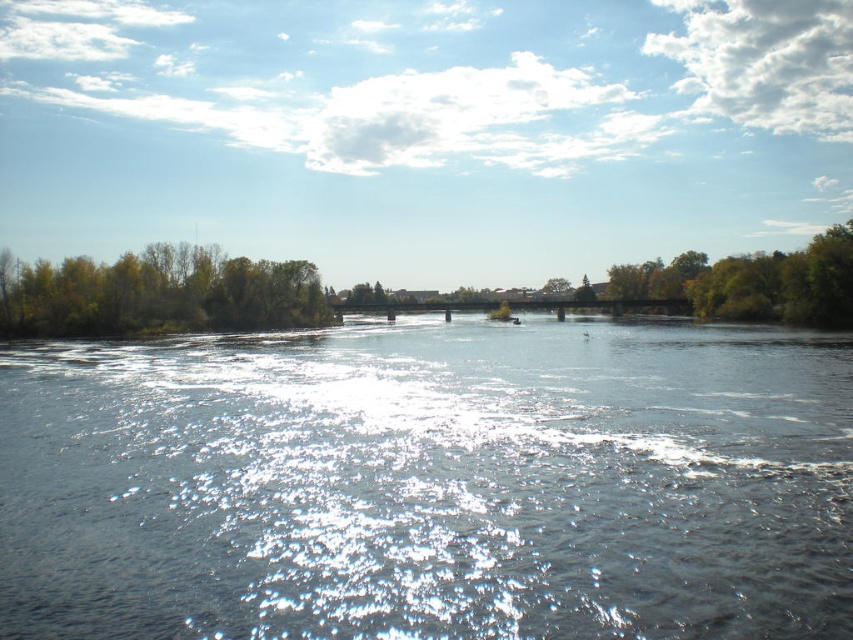
Who is more distant from viewer, (x=625, y=554) or (x=775, y=300)?

The point (x=775, y=300) is behind.

Is clear water at center to the left of green leafy tree at right from the viewer's perspective?

Indeed, clear water at center is positioned on the left side of green leafy tree at right.

Does point (73, 429) come farther from viewer compared to point (726, 259)?

No, it is not.

Where is `clear water at center`? This screenshot has height=640, width=853. clear water at center is located at coordinates (428, 484).

Is point (236, 326) behind point (757, 294)?

Yes.

Does green leafy trees at left appear under green leafy tree at right?

Yes, green leafy trees at left is below green leafy tree at right.

Measure the distance between green leafy trees at left and camera.

They are 326.95 feet apart.

This screenshot has height=640, width=853. What are the coordinates of `green leafy trees at left` in the screenshot? It's located at (157, 292).

Which is below, clear water at center or green leafy trees at left?

clear water at center

Is clear water at center closer to camera compared to green leafy trees at left?

Yes, clear water at center is in front of green leafy trees at left.

This screenshot has height=640, width=853. What do you see at coordinates (428, 484) in the screenshot? I see `clear water at center` at bounding box center [428, 484].

This screenshot has width=853, height=640. I want to click on clear water at center, so click(428, 484).